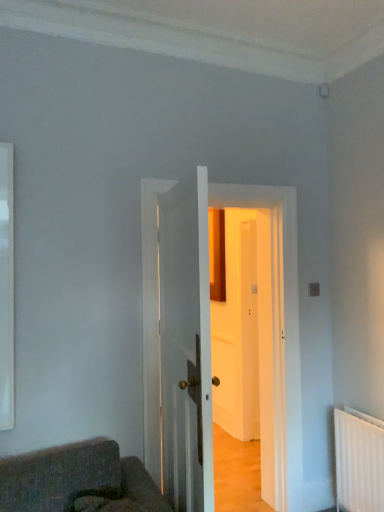
Question: From the image's perspective, is white glossy door at center, the 2th door in the back-to-front sequence, positioned above or below white wooden door at center, the 2th door from the front?

Choices:
 (A) above
 (B) below

Answer: (A)

Question: From a real-world perspective, is white glossy door at center, the 2th door in the back-to-front sequence, positioned above or below white wooden door at center, placed as the first door when sorted from back to front?

Choices:
 (A) below
 (B) above

Answer: (B)

Question: Estimate the real-world distances between objects in this image. Which object is closer to the white glossy door at center, the first door when ordered from front to back?

Choices:
 (A) white glossy window at left
 (B) white wooden door at center, the 2th door from the front

Answer: (B)

Question: Considering the real-world distances, which object is farthest from the white glossy window at left?

Choices:
 (A) white glossy door at center, the first door when ordered from front to back
 (B) white wooden door at center, placed as the first door when sorted from back to front

Answer: (A)